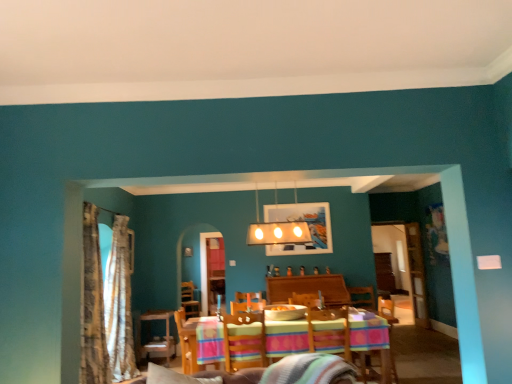
Question: Considering the relative sizes of gold textured curtain at left, positioned as the second curtain in front-to-back order, and metallic silver picture frame at center in the image provided, is gold textured curtain at left, positioned as the second curtain in front-to-back order, taller than metallic silver picture frame at center?

Choices:
 (A) no
 (B) yes

Answer: (B)

Question: From the image's perspective, does gold textured curtain at left, acting as the 1th curtain starting from the back, appear lower than metallic silver picture frame at center?

Choices:
 (A) yes
 (B) no

Answer: (A)

Question: Does gold textured curtain at left, acting as the 1th curtain starting from the back, lie in front of metallic silver picture frame at center?

Choices:
 (A) no
 (B) yes

Answer: (B)

Question: Is metallic silver picture frame at center located within gold textured curtain at left, acting as the 1th curtain starting from the back?

Choices:
 (A) yes
 (B) no

Answer: (B)

Question: Does gold textured curtain at left, positioned as the second curtain in front-to-back order, have a smaller size compared to metallic silver picture frame at center?

Choices:
 (A) yes
 (B) no

Answer: (B)

Question: From the image's perspective, relative to wooden swivel chair at center, marked as the first swivel chair in a right-to-left arrangement, is textured beige curtain at left, the 1th curtain from the front, above or below?

Choices:
 (A) above
 (B) below

Answer: (A)

Question: From their relative heights in the image, would you say textured beige curtain at left, the 2th curtain when ordered from back to front, is taller or shorter than wooden swivel chair at center, the 2th swivel chair positioned from the left?

Choices:
 (A) short
 (B) tall

Answer: (B)

Question: Looking at their shapes, would you say textured beige curtain at left, the 2th curtain when ordered from back to front, is wider or thinner than wooden swivel chair at center, the 2th swivel chair positioned from the left?

Choices:
 (A) wide
 (B) thin

Answer: (B)

Question: Considering the relative positions of textured beige curtain at left, the 2th curtain when ordered from back to front, and wooden swivel chair at center, marked as the first swivel chair in a right-to-left arrangement, in the image provided, is textured beige curtain at left, the 2th curtain when ordered from back to front, to the left or to the right of wooden swivel chair at center, marked as the first swivel chair in a right-to-left arrangement,?

Choices:
 (A) left
 (B) right

Answer: (A)

Question: Is multicolored fabric armchair at lower right, which is the 2th armchair in left-to-right order, taller or shorter than wooden swivel chair at center, which ranks as the 1th swivel chair in left-to-right order?

Choices:
 (A) tall
 (B) short

Answer: (A)

Question: From a real-world perspective, is multicolored fabric armchair at lower right, which is counted as the 1th armchair, starting from the right, positioned above or below wooden swivel chair at center, which ranks as the 1th swivel chair in left-to-right order?

Choices:
 (A) below
 (B) above

Answer: (A)

Question: From the image's perspective, is multicolored fabric armchair at lower right, which is the 2th armchair in left-to-right order, above or below wooden swivel chair at center, which is the 2th swivel chair from right to left?

Choices:
 (A) below
 (B) above

Answer: (A)

Question: Looking at the image, does multicolored fabric armchair at lower right, which is the 2th armchair in left-to-right order, seem bigger or smaller compared to wooden swivel chair at center, which is the 2th swivel chair from right to left?

Choices:
 (A) small
 (B) big

Answer: (B)

Question: Is wooden table at center spatially inside white glossy light fixture at upper center, or outside of it?

Choices:
 (A) outside
 (B) inside

Answer: (A)

Question: In terms of width, does wooden table at center look wider or thinner when compared to white glossy light fixture at upper center?

Choices:
 (A) thin
 (B) wide

Answer: (B)